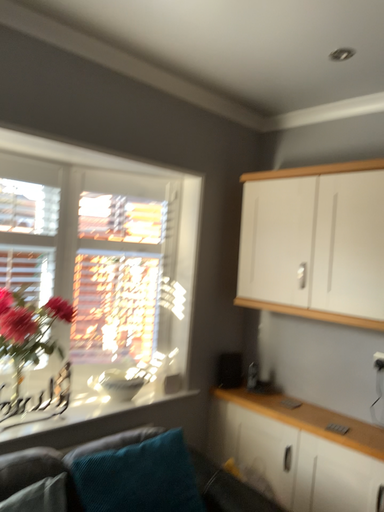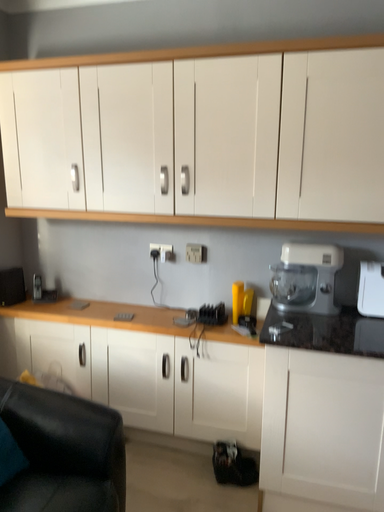
Question: How did the camera likely rotate when shooting the video?

Choices:
 (A) rotated right
 (B) rotated left

Answer: (A)